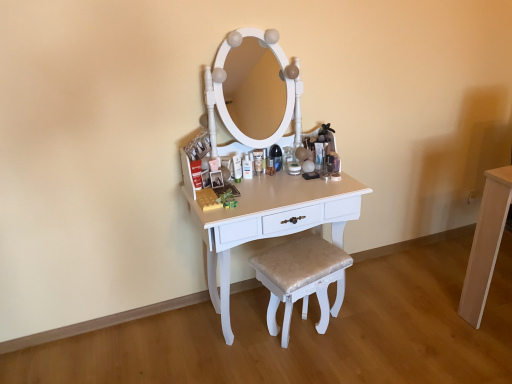
You are a GUI agent. You are given a task and a screenshot of the screen. Output one action in this format:
    pyautogui.click(x=<x>, y=<y>)
    Task: Click on the free location to the right of matte white lotion at center
    
    Given the screenshot: What is the action you would take?
    pyautogui.click(x=275, y=183)